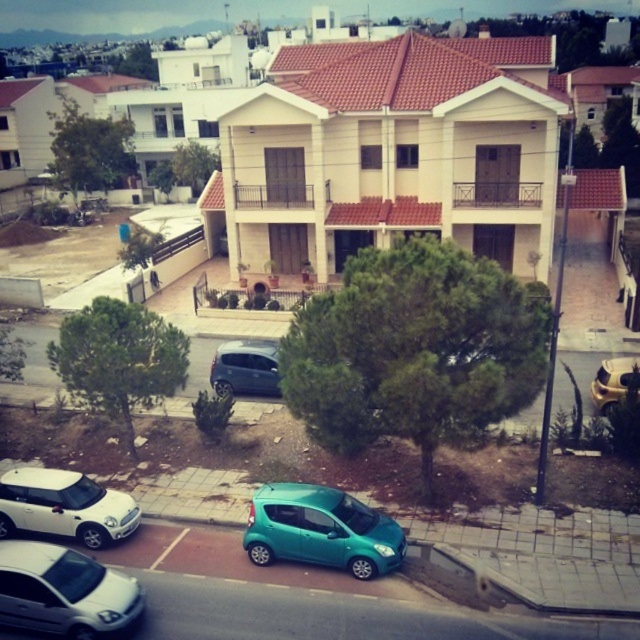
Question: Is white glossy hatchback at lower left below gold metallic helmet at upper right?

Choices:
 (A) yes
 (B) no

Answer: (A)

Question: Is white glossy hatchback at lower left wider than white matte car at lower left?

Choices:
 (A) no
 (B) yes

Answer: (A)

Question: Which object is closer to the camera taking this photo?

Choices:
 (A) gold metallic helmet at upper right
 (B) white matte car at lower left
 (C) metallic gray hatchback at center

Answer: (B)

Question: Is white matte car at lower left to the right of metallic gray hatchback at center from the viewer's perspective?

Choices:
 (A) no
 (B) yes

Answer: (A)

Question: Which of the following is the closest to the observer?

Choices:
 (A) (624, 394)
 (B) (104, 611)
 (C) (394, 540)
 (D) (262, 390)

Answer: (B)

Question: Which of these objects is positioned closest to the white glossy hatchback at lower left?

Choices:
 (A) white matte car at lower left
 (B) gold metallic helmet at upper right

Answer: (A)